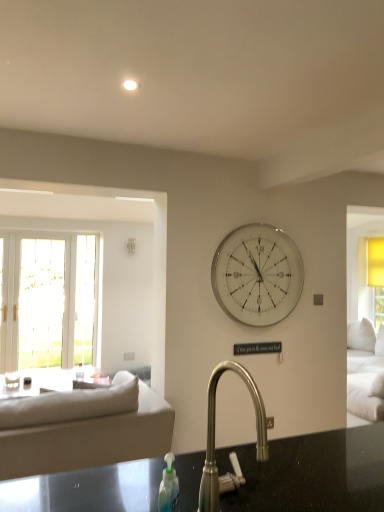
Question: From the image's perspective, does white glass wall clock at center appear lower than satin nickel faucet at center?

Choices:
 (A) yes
 (B) no

Answer: (B)

Question: Is white glass wall clock at center closer to camera compared to satin nickel faucet at center?

Choices:
 (A) yes
 (B) no

Answer: (B)

Question: Considering the relative sizes of white glass wall clock at center and satin nickel faucet at center in the image provided, is white glass wall clock at center bigger than satin nickel faucet at center?

Choices:
 (A) yes
 (B) no

Answer: (A)

Question: From a real-world perspective, is white glass wall clock at center located higher than satin nickel faucet at center?

Choices:
 (A) yes
 (B) no

Answer: (A)

Question: Does white glass wall clock at center lie behind satin nickel faucet at center?

Choices:
 (A) yes
 (B) no

Answer: (A)

Question: From the image's perspective, would you say white glass wall clock at center is positioned over satin nickel faucet at center?

Choices:
 (A) yes
 (B) no

Answer: (A)

Question: Can you confirm if satin nickel faucet at center is thinner than white glass wall clock at center?

Choices:
 (A) no
 (B) yes

Answer: (A)

Question: Is satin nickel faucet at center oriented away from white glass wall clock at center?

Choices:
 (A) yes
 (B) no

Answer: (B)

Question: Can you confirm if satin nickel faucet at center is positioned to the right of white glass wall clock at center?

Choices:
 (A) yes
 (B) no

Answer: (B)

Question: From the image's perspective, is satin nickel faucet at center beneath white glass wall clock at center?

Choices:
 (A) no
 (B) yes

Answer: (B)

Question: Does satin nickel faucet at center have a larger size compared to white glass wall clock at center?

Choices:
 (A) yes
 (B) no

Answer: (B)

Question: From a real-world perspective, is satin nickel faucet at center located beneath white glass wall clock at center?

Choices:
 (A) yes
 (B) no

Answer: (A)

Question: Can you confirm if satin nickel faucet at center is taller than beige fabric couch at left?

Choices:
 (A) no
 (B) yes

Answer: (A)